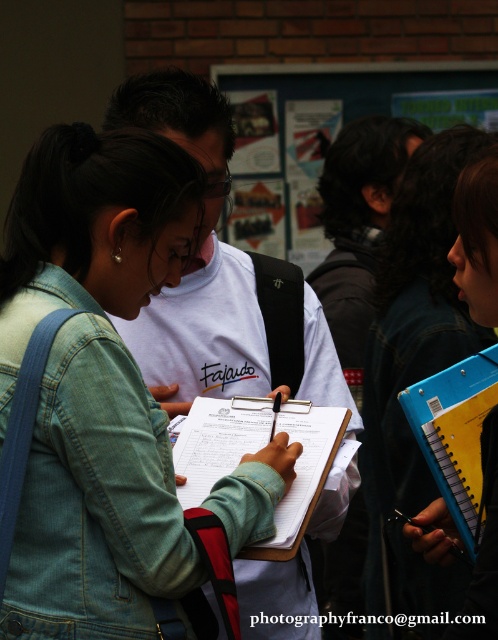
Which is behind, point (314, 634) or point (305, 513)?

Positioned behind is point (314, 634).

Measure the distance between point (310, 348) and camera.

Point (310, 348) and camera are 13.88 feet apart.

Where is `white matte t-shirt at center`? white matte t-shirt at center is located at coordinates (216, 275).

Can you confirm if white paper clipboard at center is shorter than blue plastic notebook at lower right?

Yes.

Between white paper clipboard at center and blue plastic notebook at lower right, which one has more height?

Standing taller between the two is blue plastic notebook at lower right.

In order to click on white paper clipboard at center in this screenshot , I will do `click(217, 442)`.

Is point (381, 420) less distant than point (465, 541)?

No, (381, 420) is further to viewer.

Is blue plastic folder at center above blue plastic notebook at lower right?

Indeed, blue plastic folder at center is positioned over blue plastic notebook at lower right.

Who is more distant from viewer, [429,276] or [453,397]?

Point [429,276]

Locate an element on the screen. This screenshot has width=498, height=640. blue plastic folder at center is located at coordinates (413, 371).